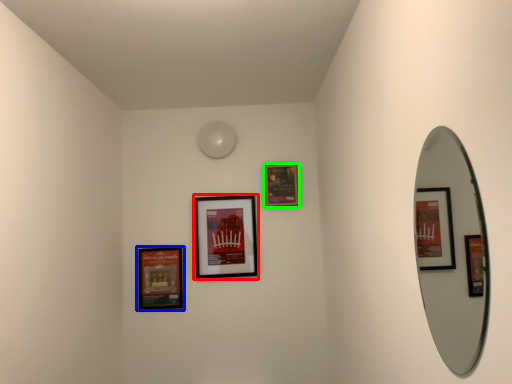
Question: Considering the real-world distances, which object is farthest from picture frame (highlighted by a red box)? picture frame (highlighted by a blue box) or picture frame (highlighted by a green box)?

Choices:
 (A) picture frame
 (B) picture frame

Answer: (B)